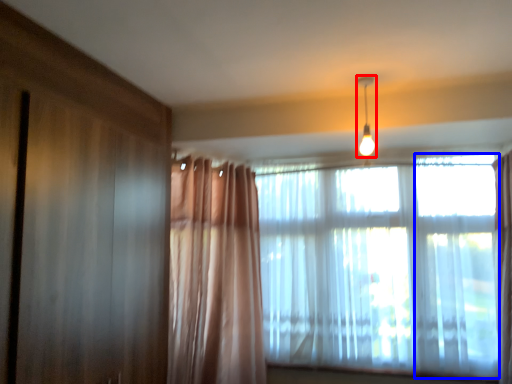
Question: Which of the following is the farthest to the observer, light fixture (highlighted by a red box) or window (highlighted by a blue box)?

Choices:
 (A) light fixture
 (B) window

Answer: (A)